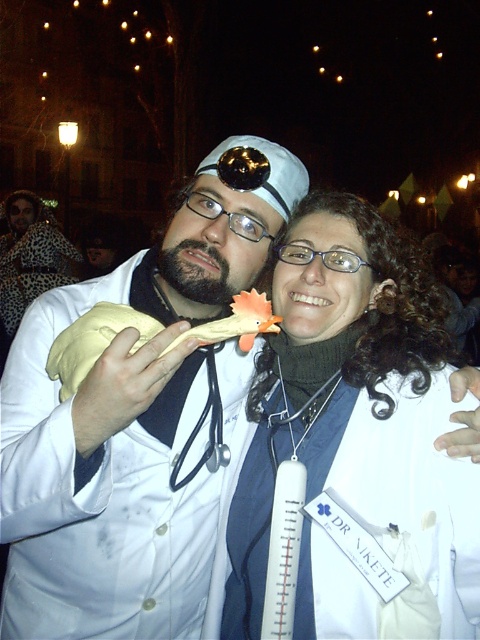
You are a photographer at a costume party and need to capture a photo of the yellow fabric toy at center and the black rubber stethoscope at center. Which object should you focus on first to ensure both are in frame?

The yellow fabric toy at center is located above the black rubber stethoscope at center. To ensure both are in frame, focus on the yellow fabric toy at center first as it is higher up, then adjust the camera angle downward to include the black rubber stethoscope at center.

You are a photographer at the event and want to place a new decoration exactly at the center of the image. However, you must ensure it doesn not overlap with the white fabric thermometer at center. Based on the coordinates provided, where should you place the decoration?

The white fabric thermometer at center is located at coordinates point (338, 384). To avoid overlapping, the decoration should be placed away from this point, perhaps slightly to the left or above it.